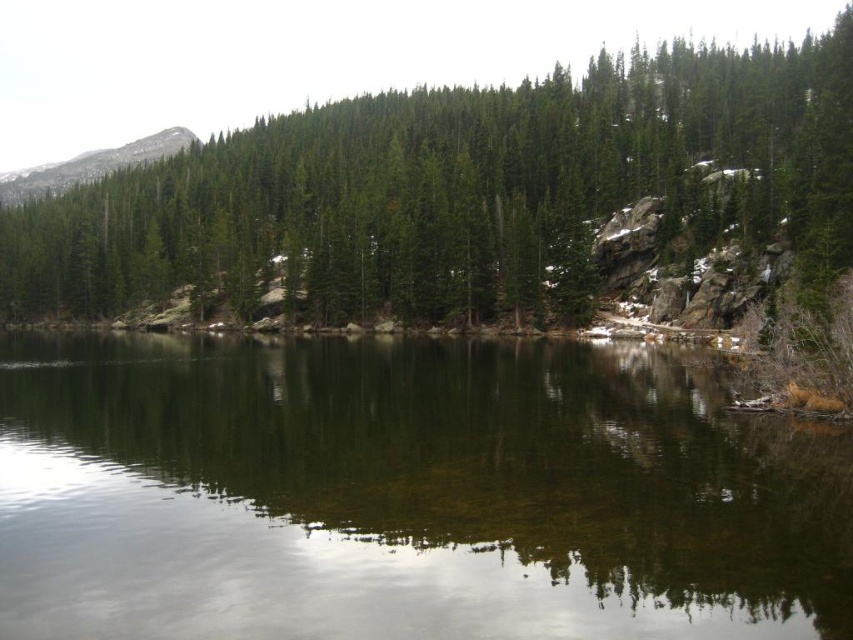
Can you confirm if green matte tree at center is positioned below gray rocky mountain at upper left?

Yes.

Is point (454, 148) behind point (115, 156)?

That is False.

Find the location of a particular element. Image resolution: width=853 pixels, height=640 pixels. green matte tree at center is located at coordinates (454, 189).

From the picture: Is green reflective water at center bigger than gray rocky mountain at upper left?

Incorrect, green reflective water at center is not larger than gray rocky mountain at upper left.

Which is behind, point (784, 492) or point (36, 195)?

Positioned behind is point (36, 195).

At what (x,y) coordinates should I click in order to perform the action: click on green reflective water at center. Please return your answer as a coordinate pair (x, y). This screenshot has height=640, width=853. Looking at the image, I should click on (405, 493).

Between green reflective water at center and green matte tree at center, which one has less height?

green reflective water at center is shorter.

Can you confirm if green reflective water at center is positioned above green matte tree at center?

Actually, green reflective water at center is below green matte tree at center.

The height and width of the screenshot is (640, 853). Describe the element at coordinates (405, 493) in the screenshot. I see `green reflective water at center` at that location.

Locate an element on the screen. green reflective water at center is located at coordinates (405, 493).